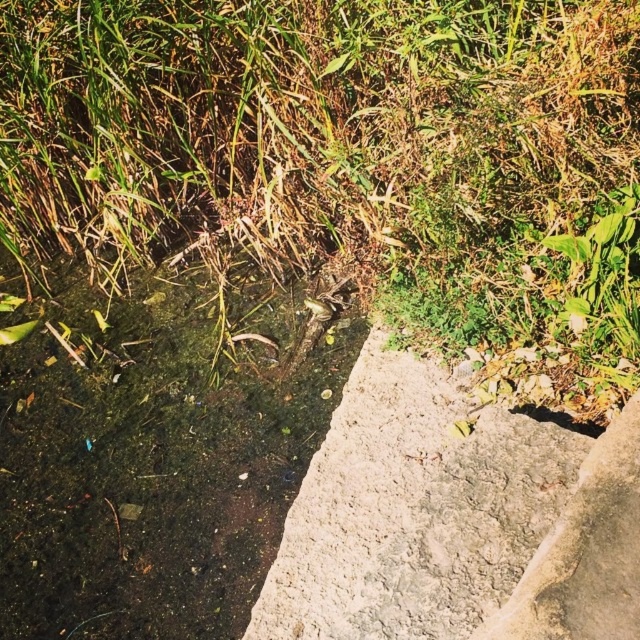
Does green grass at center have a lesser width compared to green algae water at center?

In fact, green grass at center might be wider than green algae water at center.

Which is behind, point (88, 112) or point (323, 371)?

Point (88, 112)

Which is behind, point (396, 241) or point (120, 307)?

The point (120, 307) is behind.

The width and height of the screenshot is (640, 640). Identify the location of green grass at center. (308, 129).

Is green algae water at center bigger than gray concrete wall at center?

Yes, green algae water at center is bigger than gray concrete wall at center.

The width and height of the screenshot is (640, 640). Describe the element at coordinates (147, 468) in the screenshot. I see `green algae water at center` at that location.

Identify the location of green algae water at center. This screenshot has height=640, width=640. (147, 468).

Is point (157, 16) closer to viewer compared to point (323, 440)?

No, it is behind (323, 440).

What do you see at coordinates (308, 129) in the screenshot? The image size is (640, 640). I see `green grass at center` at bounding box center [308, 129].

The width and height of the screenshot is (640, 640). I want to click on green grass at center, so click(x=308, y=129).